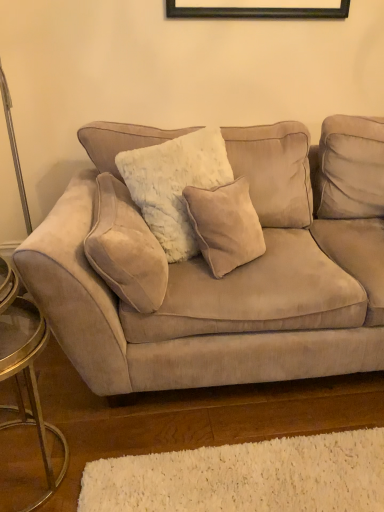
The height and width of the screenshot is (512, 384). I want to click on metallic gold side table at left, so click(25, 367).

You are a GUI agent. You are given a task and a screenshot of the screen. Output one action in this format:
    pyautogui.click(x=<x>, y=<y>)
    Task: Click on the beige suede pillow at left
    The height and width of the screenshot is (512, 384).
    Given the screenshot: What is the action you would take?
    pyautogui.click(x=125, y=248)

Identify the location of metallic gold side table at left. (25, 367).

Would you say metallic gold side table at left is outside suede couch at center?

Yes, metallic gold side table at left is outside of suede couch at center.

From the picture: Does metallic gold side table at left lie behind suede couch at center?

No, it is in front of suede couch at center.

Which is closer to the camera, (x=35, y=398) or (x=46, y=298)?

The point (x=35, y=398) is closer to the camera.

From a real-world perspective, is suede couch at center above or below metallic gold side table at left?

suede couch at center is above metallic gold side table at left.

Which is closer, (235, 327) or (41, 334)?

Point (41, 334)

Is suede couch at center facing towards metallic gold side table at left?

No, suede couch at center is not turned towards metallic gold side table at left.

Looking at this image, can you tell me how much suede couch at center and metallic gold side table at left differ in facing direction?

0.136 degrees.

How many degrees apart are the facing directions of white shag rug at lower center and metallic gold side table at left?

The angular difference between white shag rug at lower center and metallic gold side table at left is 179 degrees.

Does point (344, 488) come farther from viewer compared to point (19, 350)?

That is True.

Is metallic gold side table at left a part of white shag rug at lower center?

No, metallic gold side table at left is not inside white shag rug at lower center.

Can you confirm if white shag rug at lower center is smaller than metallic gold side table at left?

Yes.

At what (x,y) coordinates should I click in order to perform the action: click on plain located on the left of suede couch at center. Please return your answer as a coordinate pair (x, y). Image resolution: width=384 pixels, height=512 pixels. Looking at the image, I should click on (245, 477).

Is the surface of white shag rug at lower center in direct contact with suede couch at center?

No, white shag rug at lower center is not making contact with suede couch at center.

Does white shag rug at lower center have a lesser height compared to suede couch at center?

Indeed, white shag rug at lower center has a lesser height compared to suede couch at center.

Which is nearer, (333, 471) or (260, 130)?

The point (333, 471) is closer.

Relative to beige suede pillow at left, is suede couch at center in front or behind?

In the image, suede couch at center appears in front of beige suede pillow at left.

From a real-world perspective, is suede couch at center under beige suede pillow at left?

Yes, from a real-world perspective, suede couch at center is below beige suede pillow at left.

In the image, is suede couch at center on the left side or the right side of beige suede pillow at left?

In the image, suede couch at center appears on the right side of beige suede pillow at left.

Is beige suede pillow at left located within suede couch at center?

Absolutely, beige suede pillow at left is inside suede couch at center.

From the image's perspective, is beige suede pillow at left on top of suede couch at center?

No, from the image's perspective, beige suede pillow at left is not above suede couch at center.

How far apart are beige suede pillow at left and suede couch at center?

beige suede pillow at left and suede couch at center are 28.88 centimeters apart from each other.

Can suede couch at center be found inside beige suede pillow at left?

That's incorrect, suede couch at center is not inside beige suede pillow at left.

Considering the relative positions of beige suede pillow at left and suede couch at center in the image provided, is beige suede pillow at left behind suede couch at center?

Yes, it is behind suede couch at center.

Is metallic gold side table at left at the back of beige suede pillow at left?

No, beige suede pillow at left's orientation is not away from metallic gold side table at left.

Is beige suede pillow at left at the right side of metallic gold side table at left?

Yes, beige suede pillow at left is to the right of metallic gold side table at left.

From the image's perspective, which object appears higher, beige suede pillow at left or metallic gold side table at left?

beige suede pillow at left.

From a real-world perspective, is beige suede pillow at left on top of metallic gold side table at left?

Yes, from a real-world perspective, beige suede pillow at left is over metallic gold side table at left

Where is `studio couch above the metallic gold side table at left (from the image's perspective)`? Image resolution: width=384 pixels, height=512 pixels. studio couch above the metallic gold side table at left (from the image's perspective) is located at coordinates (209, 269).

Find the location of a particular element. side table that is below the suede couch at center (from the image's perspective) is located at coordinates (25, 367).

Which object lies nearer to the anchor point metallic gold side table at left, white shag rug at lower center or beige suede pillow at left?

beige suede pillow at left is positioned closer to the anchor metallic gold side table at left.

Estimate the real-world distances between objects in this image. Which object is further from suede couch at center, white shag rug at lower center or beige suede pillow at left?

Based on the image, white shag rug at lower center appears to be further to suede couch at center.

When comparing their distances from beige suede pillow at left, does white shag rug at lower center or metallic gold side table at left seem further?

Among the two, white shag rug at lower center is located further to beige suede pillow at left.

From the image, which object appears to be nearer to suede couch at center, metallic gold side table at left or white shag rug at lower center?

white shag rug at lower center lies closer to suede couch at center than the other object.

Based on their spatial positions, is metallic gold side table at left or suede couch at center closer to beige suede pillow at left?

Among the two, suede couch at center is located nearer to beige suede pillow at left.

When comparing their distances from beige suede pillow at left, does suede couch at center or white shag rug at lower center seem further?

Among the two, white shag rug at lower center is located further to beige suede pillow at left.

Estimate the real-world distances between objects in this image. Which object is further from beige suede pillow at left, suede couch at center or metallic gold side table at left?

→ The object further to beige suede pillow at left is metallic gold side table at left.

Looking at the image, which one is located further to suede couch at center, metallic gold side table at left or beige suede pillow at left?

Among the two, metallic gold side table at left is located further to suede couch at center.

Find the location of a particular element. This screenshot has height=512, width=384. plain between metallic gold side table at left and suede couch at center in the horizontal direction is located at coordinates (245, 477).

I want to click on pillow between metallic gold side table at left and white shag rug at lower center from left to right, so click(125, 248).

Find the location of a particular element. pillow between suede couch at center and white shag rug at lower center in the up-down direction is located at coordinates point(125,248).

Locate an element on the screen. pillow between metallic gold side table at left and suede couch at center in the horizontal direction is located at coordinates (125, 248).